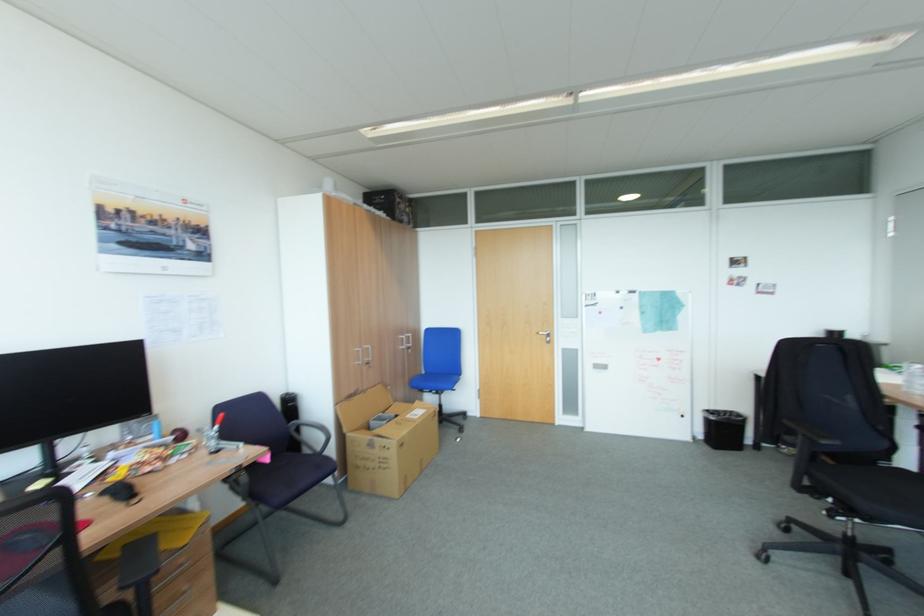
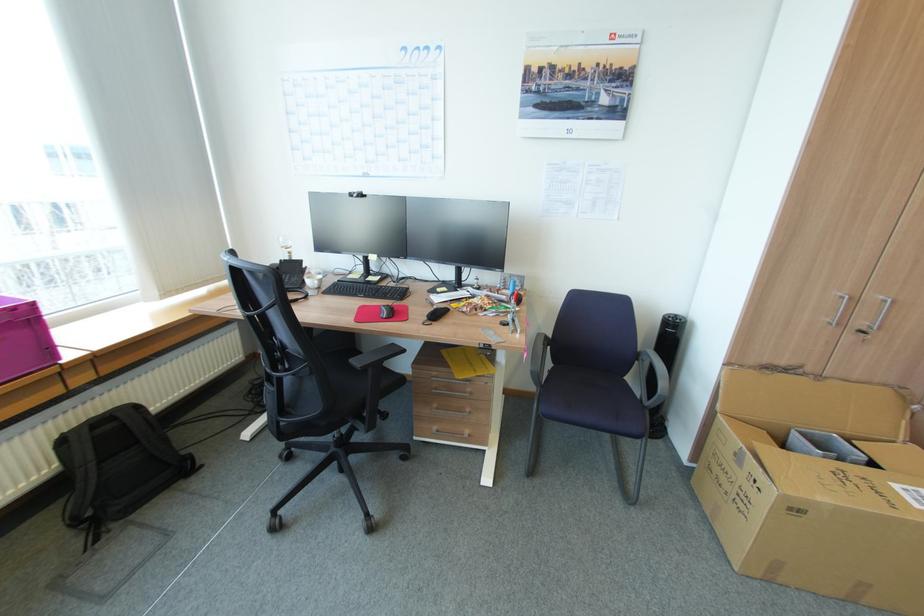
In the second image, find the point that corresponds to [373,363] in the first image.

(868, 331)